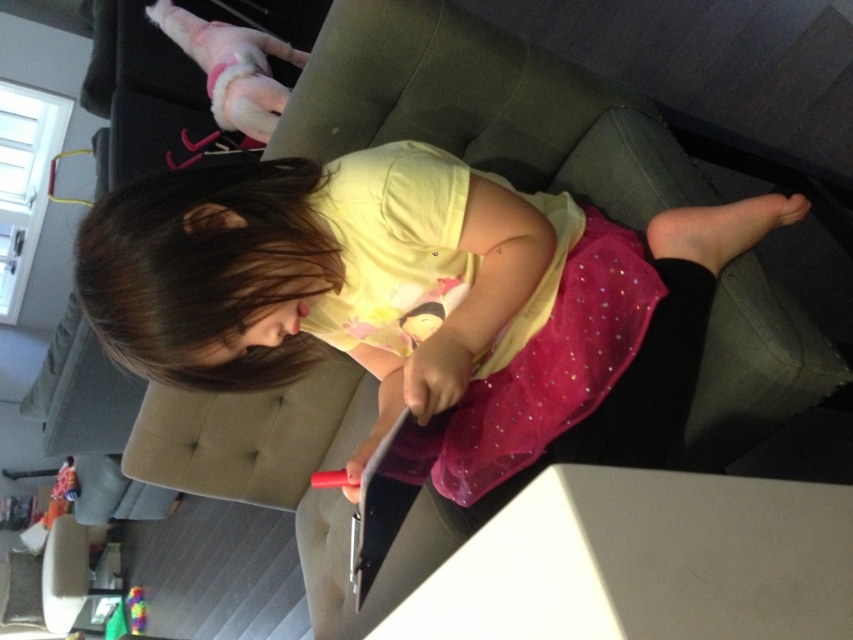
Which is below, pink tulle skirt at center or sparkly tulle dress at center?

pink tulle skirt at center is lower down.

Does pink tulle skirt at center have a smaller size compared to sparkly tulle dress at center?

Actually, pink tulle skirt at center might be larger than sparkly tulle dress at center.

Does point (312, 196) lie behind point (495, 356)?

No, it is not.

At what (x,y) coordinates should I click in order to perform the action: click on pink tulle skirt at center. Please return your answer as a coordinate pair (x, y). This screenshot has width=853, height=640. Looking at the image, I should click on pos(328,275).

Is point (59, 490) farther from viewer compared to point (138, 602)?

No, (59, 490) is closer to viewer.

In the scene shown: Can you confirm if plush pink stuffed animal at upper left is bigger than multicolored plastic toy at lower left?

Correct, plush pink stuffed animal at upper left is larger in size than multicolored plastic toy at lower left.

Does point (64, 464) come farther from viewer compared to point (131, 600)?

No, it is not.

I want to click on plush pink stuffed animal at upper left, so click(61, 492).

Between sparkly tulle dress at center and multicolored plastic toy at lower left, which one has less height?

multicolored plastic toy at lower left

Does sparkly tulle dress at center have a greater width compared to multicolored plastic toy at lower left?

Indeed, sparkly tulle dress at center has a greater width compared to multicolored plastic toy at lower left.

Identify the location of sparkly tulle dress at center. The height and width of the screenshot is (640, 853). (467, 292).

At what (x,y) coordinates should I click in order to perform the action: click on sparkly tulle dress at center. Please return your answer as a coordinate pair (x, y). This screenshot has width=853, height=640. Looking at the image, I should click on (467, 292).